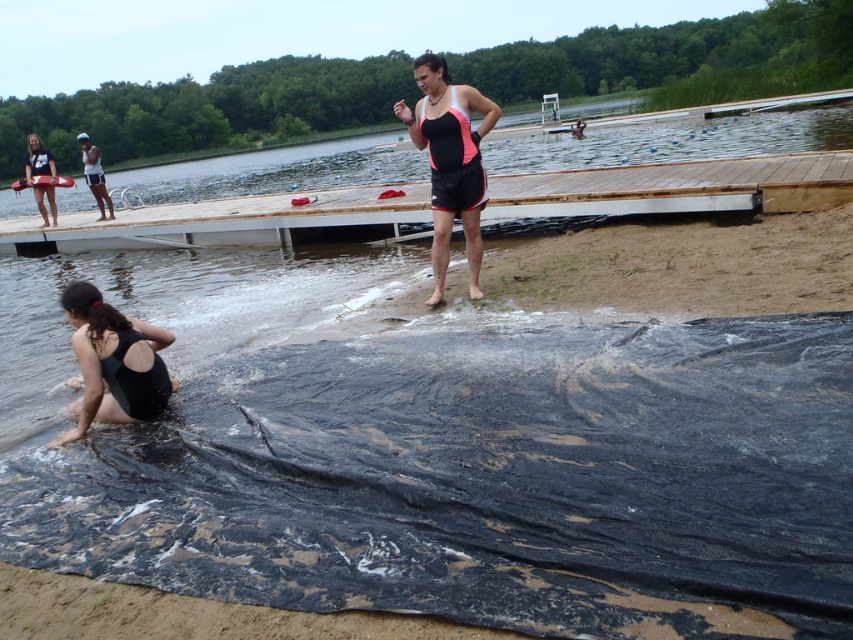
Question: Is matte black swimsuit at center closer to the viewer compared to matte black life preserver at upper left?

Choices:
 (A) yes
 (B) no

Answer: (A)

Question: Which of the following is the closest to the observer?

Choices:
 (A) (138, 333)
 (B) (200, 228)
 (C) (41, 212)

Answer: (A)

Question: Based on their relative distances, which object is nearer to the black matte swimsuit at lower left?

Choices:
 (A) wooden dock at center
 (B) matte black swimsuit at center
 (C) matte black life preserver at upper left

Answer: (B)

Question: Among these points, which one is farthest from the camera?

Choices:
 (A) (625, 168)
 (B) (36, 148)
 (C) (451, 97)
 (D) (97, 339)

Answer: (B)

Question: Can you confirm if matte black swimsuit at center is wider than black matte swimsuit at lower left?

Choices:
 (A) no
 (B) yes

Answer: (B)

Question: Is matte black swimsuit at center thinner than black matte swimsuit at lower left?

Choices:
 (A) yes
 (B) no

Answer: (B)